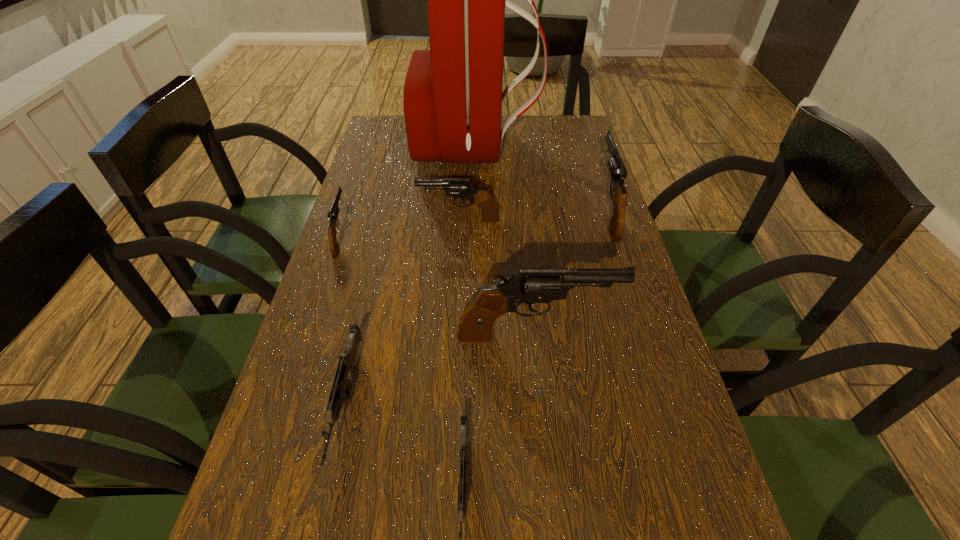
Where is `the sixth tallest object`? Image resolution: width=960 pixels, height=540 pixels. the sixth tallest object is located at coordinates (347, 363).

Locate an element on the screen. the bigger grey gun is located at coordinates (347, 363).

You are a GUI agent. You are given a task and a screenshot of the screen. Output one action in this format:
    pyautogui.click(x=<x>, y=<y>)
    Task: Click on the vacant space located 0.120m on the strap side of the tallest object
    The width and height of the screenshot is (960, 540).
    Given the screenshot: What is the action you would take?
    tap(571, 147)

Find the location of a particular element. free space located along the barrel of the nearest black gun is located at coordinates (646, 336).

Where is `vacant space located 0.360m along the barrel of the second tallest gun`? vacant space located 0.360m along the barrel of the second tallest gun is located at coordinates (579, 124).

This screenshot has width=960, height=540. What are the coordinates of `vacant space situated along the barrel of the second tallest gun` in the screenshot? It's located at (588, 151).

Find the location of a particular element. The width and height of the screenshot is (960, 540). free spot located 0.140m along the barrel of the second tallest gun is located at coordinates (589, 157).

Where is `vacant space situated 0.190m along the barrel of the second smallest black gun`? Image resolution: width=960 pixels, height=540 pixels. vacant space situated 0.190m along the barrel of the second smallest black gun is located at coordinates (348, 220).

You are a GUI agent. You are given a task and a screenshot of the screen. Output one action in this format:
    pyautogui.click(x=<x>, y=<y>)
    Task: Click on the vacant space located 0.190m along the barrel of the second smallest black gun
    
    Given the screenshot: What is the action you would take?
    pyautogui.click(x=348, y=220)

Find the location of a particular element. vacant region located 0.340m along the barrel of the smallest black gun is located at coordinates (370, 152).